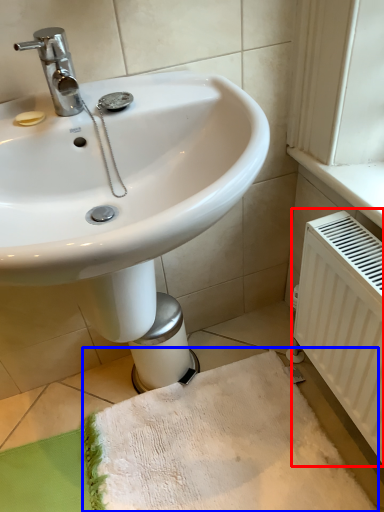
Question: Which of the following is the closest to the observer, radiator (highlighted by a red box) or bath towel (highlighted by a blue box)?

Choices:
 (A) radiator
 (B) bath towel

Answer: (A)